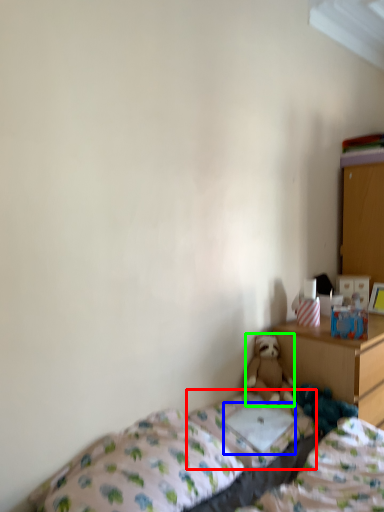
Question: Which object is positioned farthest from mattress (highlighted by a red box)? Select from pillow (highlighted by a blue box) and teddy bear (highlighted by a green box).

Choices:
 (A) pillow
 (B) teddy bear

Answer: (B)